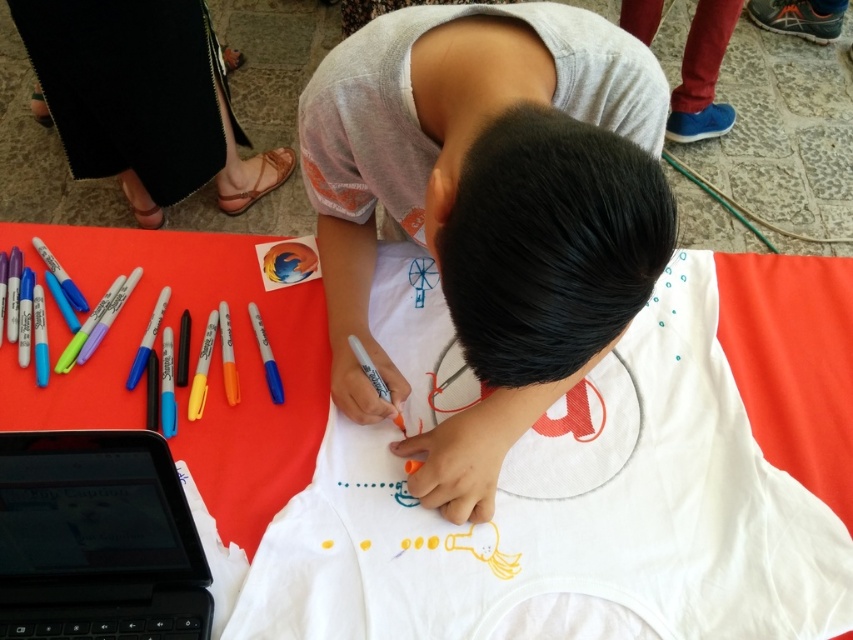
Question: Is white matte shirt at center bigger than black plastic laptop at lower left?

Choices:
 (A) yes
 (B) no

Answer: (A)

Question: Which of the following is the farthest from the observer?

Choices:
 (A) white fabric at center
 (B) black plastic laptop at lower left

Answer: (A)

Question: Which is nearer to the black shiny hair at center?

Choices:
 (A) white fabric at center
 (B) black plastic laptop at lower left

Answer: (A)

Question: Does white fabric at center have a larger size compared to black shiny hair at center?

Choices:
 (A) yes
 (B) no

Answer: (A)

Question: Is black shiny hair at center thinner than black plastic laptop at lower left?

Choices:
 (A) yes
 (B) no

Answer: (A)

Question: Among these points, which one is farthest from the camera?

Choices:
 (A) (576, 568)
 (B) (457, 266)
 (C) (457, 129)

Answer: (A)